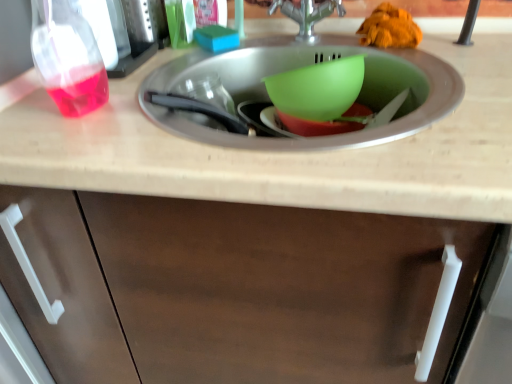
The image size is (512, 384). I want to click on free spot behind transparent plastic bottle at left, so click(147, 71).